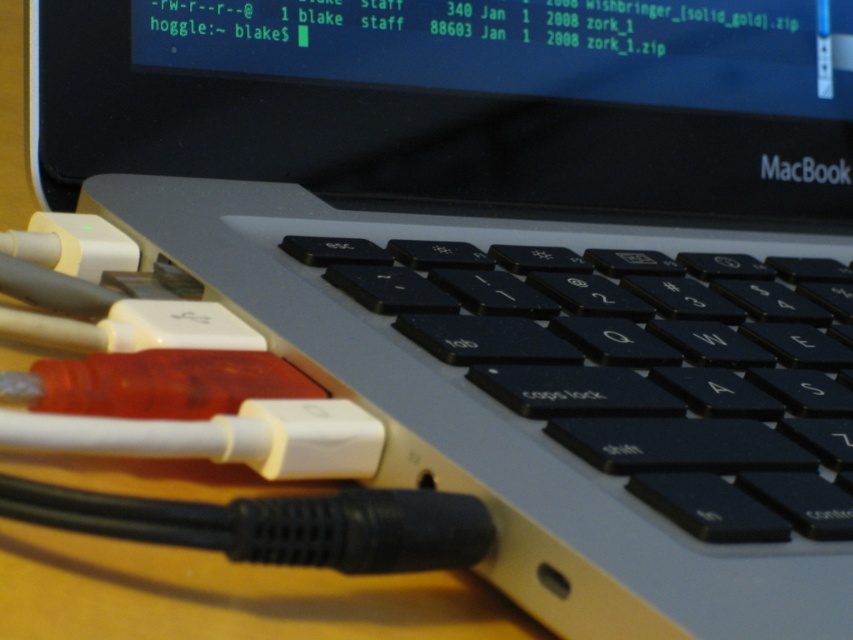
Question: Is black glossy screen at upper center further to camera compared to black matte keyboard at center?

Choices:
 (A) yes
 (B) no

Answer: (A)

Question: Observing the image, what is the correct spatial positioning of black glossy screen at upper center in reference to black matte keyboard at center?

Choices:
 (A) below
 (B) above

Answer: (B)

Question: Which point is closer to the camera taking this photo?

Choices:
 (A) (717, 534)
 (B) (67, 166)

Answer: (A)

Question: Can you confirm if black glossy screen at upper center is bigger than black matte keyboard at center?

Choices:
 (A) yes
 (B) no

Answer: (A)

Question: Among these objects, which one is nearest to the camera?

Choices:
 (A) black glossy screen at upper center
 (B) black matte keyboard at center

Answer: (B)